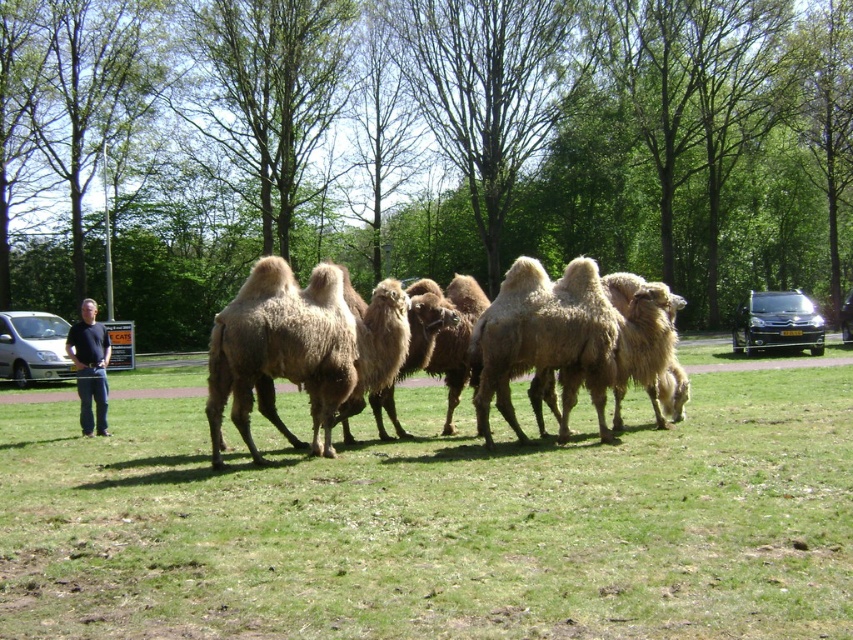
Question: Can you confirm if brown fuzzy camel at center is thinner than black shirt at left?

Choices:
 (A) yes
 (B) no

Answer: (B)

Question: Can you confirm if fuzzy beige camels at center is wider than black metallic car at right?

Choices:
 (A) yes
 (B) no

Answer: (A)

Question: Estimate the real-world distances between objects in this image. Which object is farther from the brown fuzzy camel at center?

Choices:
 (A) fuzzy beige camels at center
 (B) black shirt at left
 (C) silver metallic car at left
 (D) black metallic car at right

Answer: (D)

Question: Is brown fuzzy camel at center thinner than black metallic car at right?

Choices:
 (A) yes
 (B) no

Answer: (A)

Question: Which object is the farthest from the fuzzy beige camels at center?

Choices:
 (A) silver metallic car at left
 (B) brown fuzzy camel at center
 (C) black metallic car at right

Answer: (C)

Question: Which of the following is the closest to the observer?

Choices:
 (A) black metallic car at right
 (B) silver metallic car at left

Answer: (B)